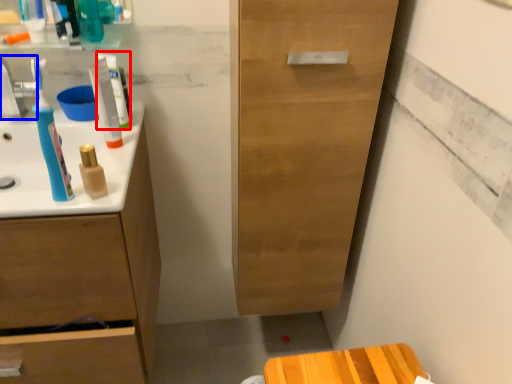
Question: Which object appears closest to the camera in this image, toothpaste (highlighted by a red box) or faucet (highlighted by a blue box)?

Choices:
 (A) toothpaste
 (B) faucet

Answer: (B)